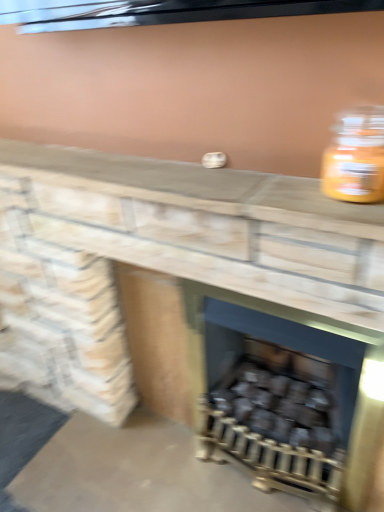
Question: Is dark gray matte wood burning stove at center bigger than smooth stone counter at center?

Choices:
 (A) yes
 (B) no

Answer: (A)

Question: Does dark gray matte wood burning stove at center have a lesser height compared to smooth stone counter at center?

Choices:
 (A) yes
 (B) no

Answer: (B)

Question: Can you confirm if dark gray matte wood burning stove at center is wider than smooth stone counter at center?

Choices:
 (A) yes
 (B) no

Answer: (A)

Question: From the image's perspective, does dark gray matte wood burning stove at center appear lower than smooth stone counter at center?

Choices:
 (A) yes
 (B) no

Answer: (A)

Question: Is dark gray matte wood burning stove at center to the left of smooth stone counter at center from the viewer's perspective?

Choices:
 (A) no
 (B) yes

Answer: (A)

Question: Is dark gray matte wood burning stove at center taller than smooth stone counter at center?

Choices:
 (A) no
 (B) yes

Answer: (B)

Question: Is smooth stone counter at center located within translucent glass jar at upper right?

Choices:
 (A) yes
 (B) no

Answer: (B)

Question: From a real-world perspective, is translucent glass jar at upper right under smooth stone counter at center?

Choices:
 (A) yes
 (B) no

Answer: (B)

Question: From a real-world perspective, is translucent glass jar at upper right on smooth stone counter at center?

Choices:
 (A) yes
 (B) no

Answer: (A)

Question: Is translucent glass jar at upper right not inside smooth stone counter at center?

Choices:
 (A) yes
 (B) no

Answer: (A)

Question: Considering the relative sizes of translucent glass jar at upper right and smooth stone counter at center in the image provided, is translucent glass jar at upper right shorter than smooth stone counter at center?

Choices:
 (A) yes
 (B) no

Answer: (B)

Question: Is translucent glass jar at upper right thinner than smooth stone counter at center?

Choices:
 (A) no
 (B) yes

Answer: (B)

Question: Is black matte wood at center bigger than dark gray matte wood burning stove at center?

Choices:
 (A) yes
 (B) no

Answer: (B)